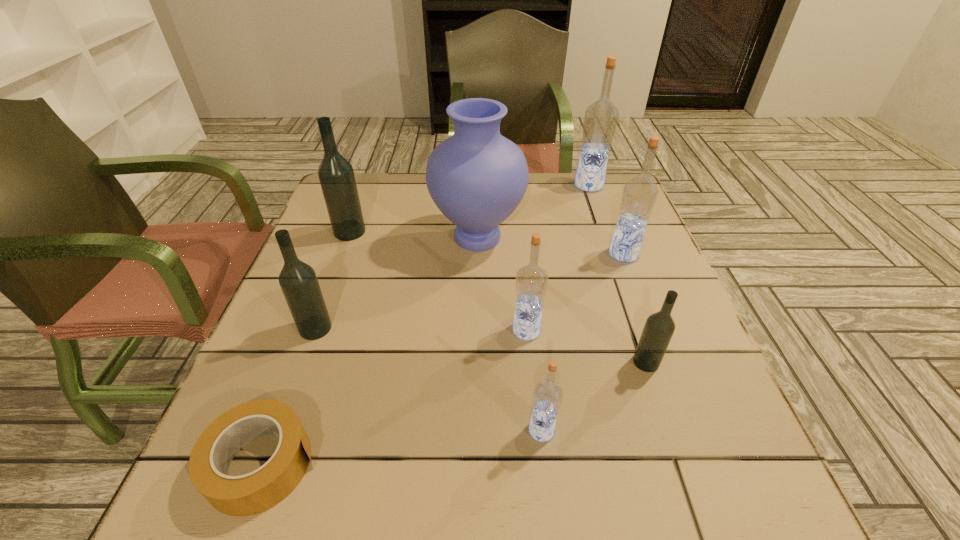
At what (x,y) coordinates should I click in order to perform the action: click on blank region between the biggest blue vodka and the blue vase. Please return your answer as a coordinate pair (x, y). The width and height of the screenshot is (960, 540). Looking at the image, I should click on (533, 211).

Locate an element on the screen. Image resolution: width=960 pixels, height=540 pixels. free space between the nearest blue vodka and the third farthest blue vodka is located at coordinates (534, 380).

Where is `vacant area between the smallest blue vodka and the sixth nearest vodka`? The width and height of the screenshot is (960, 540). vacant area between the smallest blue vodka and the sixth nearest vodka is located at coordinates (445, 331).

What are the coordinates of `free area in between the blue vase and the nearest blue vodka` in the screenshot? It's located at (510, 334).

Locate an element on the screen. empty location between the farthest object and the second smallest blue vodka is located at coordinates (558, 258).

Locate an element on the screen. object that is the seventh closest to the biggest blue vodka is located at coordinates (298, 281).

Where is `object that is the second closest to the blue vase`? The image size is (960, 540). object that is the second closest to the blue vase is located at coordinates (336, 175).

Identify the location of the third closest vodka to the sixth nearest vodka. Image resolution: width=960 pixels, height=540 pixels. point(600,121).

You are a GUI agent. You are given a task and a screenshot of the screen. Output one action in this format:
    pyautogui.click(x=<x>, y=<y>)
    Task: Click on the vodka that is the fourth closest to the second smallest black vodka
    The width and height of the screenshot is (960, 540).
    Given the screenshot: What is the action you would take?
    pyautogui.click(x=658, y=330)

Locate an element on the screen. blue vodka that stands as the third closest to the smallest blue vodka is located at coordinates (600, 121).